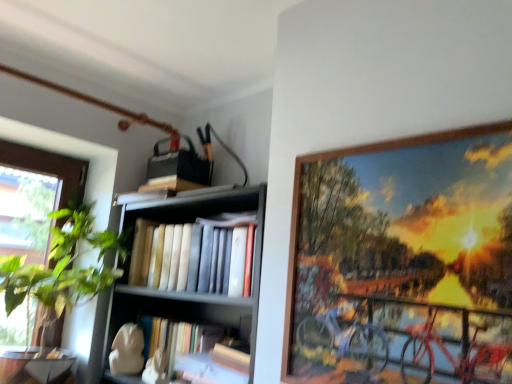
Question: Is wooden bookshelf at center bigger or smaller than green leafy plant at left?

Choices:
 (A) small
 (B) big

Answer: (B)

Question: Is point (205, 278) positioned closer to the camera than point (112, 241)?

Choices:
 (A) closer
 (B) farther

Answer: (A)

Question: Which object is the farthest from the hardcover books at center?

Choices:
 (A) wooden bookshelf at center
 (B) wooden picture frame at upper right
 (C) green leafy plant at left

Answer: (B)

Question: Which object is the closest to the wooden bookshelf at center?

Choices:
 (A) hardcover books at center
 (B) wooden picture frame at upper right
 (C) green leafy plant at left

Answer: (A)